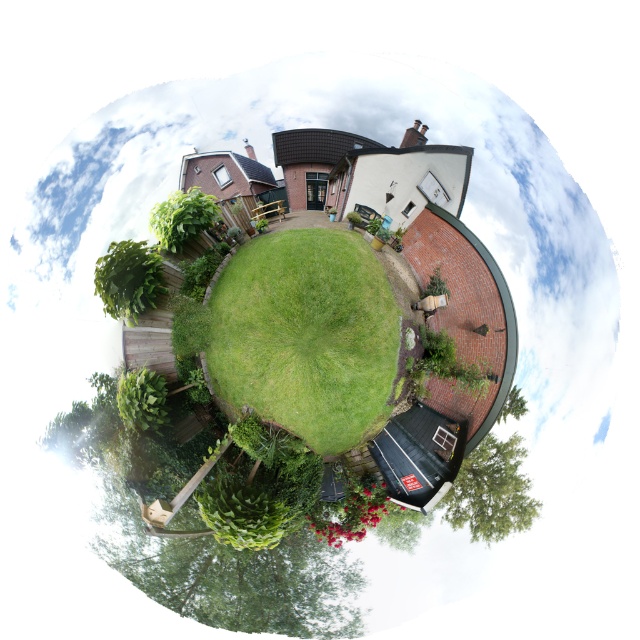
Question: Estimate the real-world distances between objects in this image. Which object is closer to the green leafy tree at center?

Choices:
 (A) green leafy tree at lower left
 (B) green leafy tree at lower right
 (C) green grass at center
 (D) green leafy tree at upper left

Answer: (B)

Question: Observing the image, what is the correct spatial positioning of green leafy tree at lower right in reference to green leafy tree at center?

Choices:
 (A) above
 (B) below

Answer: (B)

Question: Which object is positioned closest to the green leafy tree at center?

Choices:
 (A) green leafy tree at lower right
 (B) green leafy tree at lower left
 (C) green grass at center

Answer: (A)

Question: Does green leafy tree at upper left appear on the right side of green leafy tree at center?

Choices:
 (A) no
 (B) yes

Answer: (A)

Question: Does green leafy tree at lower left appear on the left side of green leafy tree at center?

Choices:
 (A) no
 (B) yes

Answer: (B)

Question: Among these objects, which one is farthest from the camera?

Choices:
 (A) green leafy tree at upper left
 (B) green leafy tree at lower right

Answer: (A)